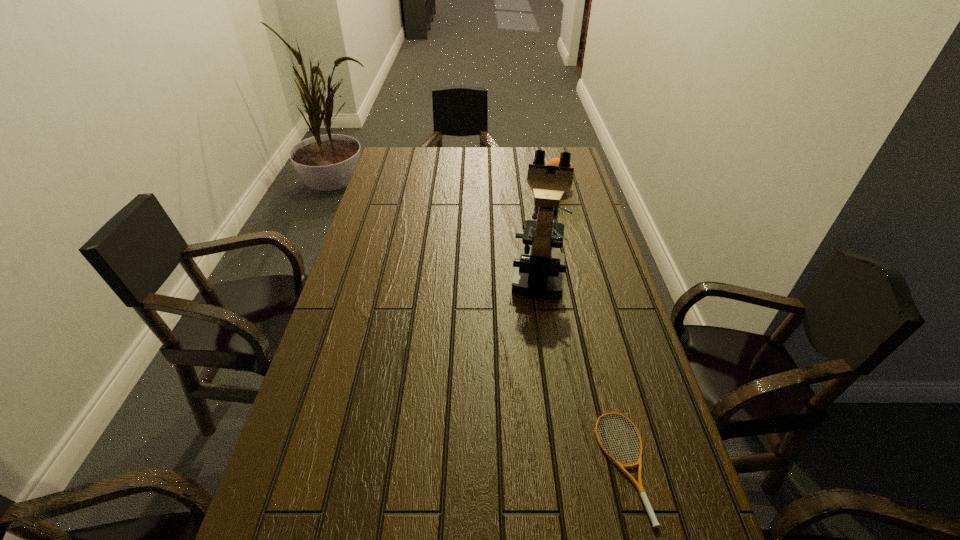
Where is `empty space between the tennis racket and the orange`? empty space between the tennis racket and the orange is located at coordinates (590, 326).

You are a GUI agent. You are given a task and a screenshot of the screen. Output one action in this format:
    pyautogui.click(x=<x>, y=<y>)
    Task: Click on the free space between the tennis racket and the farthest object
    
    Given the screenshot: What is the action you would take?
    pyautogui.click(x=590, y=326)

Identify the location of vacant area that lies between the tallest object and the nearest object. The width and height of the screenshot is (960, 540). (x=581, y=369).

Identify the location of unoccupied position between the nearest object and the microscope. This screenshot has height=540, width=960. (581, 369).

Locate which object ranks in proximity to the farthest object. Please provide its 2D coordinates. Your answer should be formatted as a tuple, i.e. [(x, y)], where the tuple contains the x and y coordinates of a point satisfying the conditions above.

[(539, 271)]

You are a GUI agent. You are given a task and a screenshot of the screen. Output one action in this format:
    pyautogui.click(x=<x>, y=<y>)
    Task: Click on the object that is the closest to the second shortest object
    The image size is (960, 540).
    Given the screenshot: What is the action you would take?
    pyautogui.click(x=539, y=271)

The image size is (960, 540). I want to click on vacant space that satisfies the following two spatial constraints: 1. on the back side of the second nearest object; 2. on the left side of the farthest object, so click(525, 186).

The width and height of the screenshot is (960, 540). I want to click on free space that satisfies the following two spatial constraints: 1. on the back side of the orange; 2. on the right side of the tallest object, so click(x=525, y=186).

Locate an element on the screen. Image resolution: width=960 pixels, height=540 pixels. free space that satisfies the following two spatial constraints: 1. on the back side of the second farthest object; 2. on the right side of the orange is located at coordinates (525, 186).